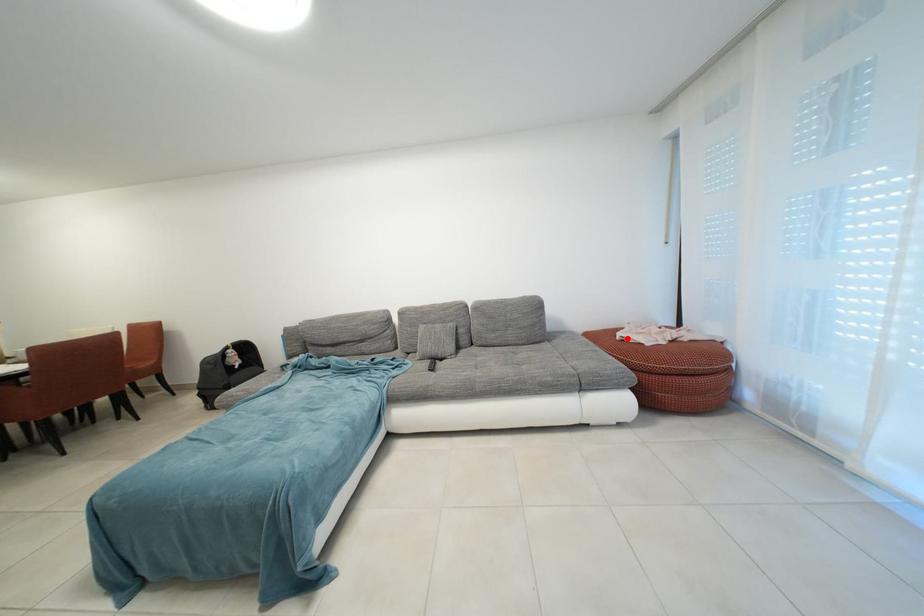
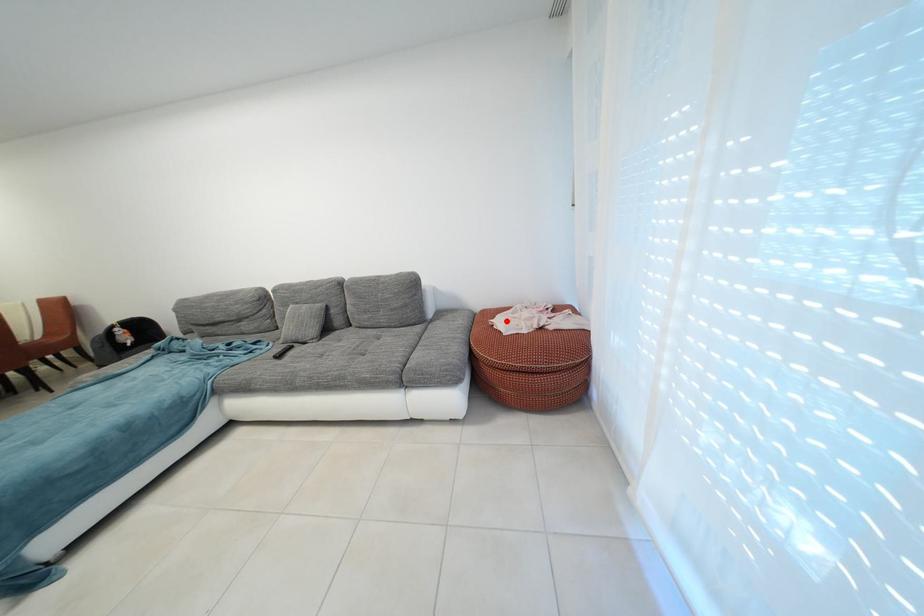
I am providing you with two images of the same scene from different viewpoints. A red point is marked on the first image and another point is marked on the second image. Is the marked point in image1 the same physical position as the marked point in image2?

Yes